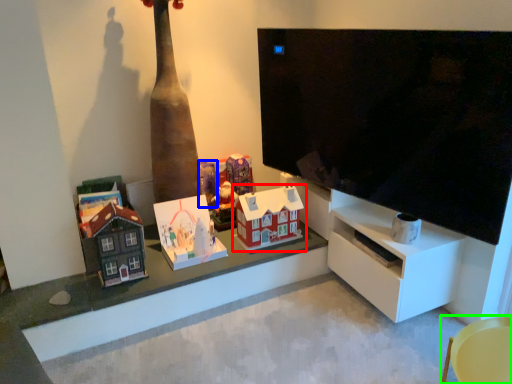
Question: Estimate the real-world distances between objects in this image. Which object is closer to toy (highlighted by a red box), toy (highlighted by a blue box) or furniture (highlighted by a green box)?

Choices:
 (A) toy
 (B) furniture

Answer: (A)